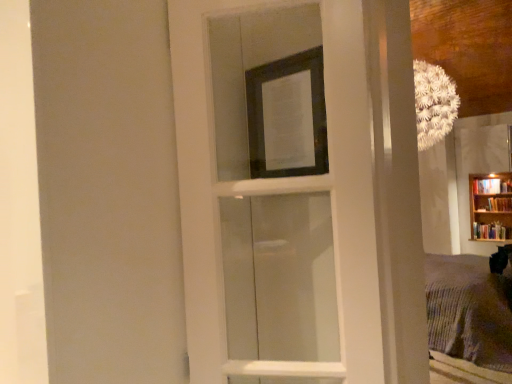
Question: Is wooden bookcase at right positioned beyond the bounds of white glass door at center?

Choices:
 (A) no
 (B) yes

Answer: (B)

Question: Is the depth of wooden bookcase at right greater than that of white glass door at center?

Choices:
 (A) no
 (B) yes

Answer: (B)

Question: Is there a large distance between wooden bookcase at right and white glass door at center?

Choices:
 (A) no
 (B) yes

Answer: (B)

Question: From the image's perspective, is wooden bookcase at right under white glass door at center?

Choices:
 (A) no
 (B) yes

Answer: (B)

Question: Is wooden bookcase at right bigger than white glass door at center?

Choices:
 (A) no
 (B) yes

Answer: (B)

Question: Does wooden bookcase at right appear on the right side of white glass door at center?

Choices:
 (A) yes
 (B) no

Answer: (A)

Question: From the image's perspective, is white glass door at center over wooden bookcase at right?

Choices:
 (A) no
 (B) yes

Answer: (B)

Question: Is white glass door at center oriented away from wooden bookcase at right?

Choices:
 (A) no
 (B) yes

Answer: (A)

Question: Would you say white glass door at center is outside wooden bookcase at right?

Choices:
 (A) yes
 (B) no

Answer: (A)

Question: From a real-world perspective, is white glass door at center on wooden bookcase at right?

Choices:
 (A) yes
 (B) no

Answer: (A)

Question: Does white glass door at center have a lesser height compared to wooden bookcase at right?

Choices:
 (A) no
 (B) yes

Answer: (A)

Question: Considering the relative positions of white glass door at center and wooden bookcase at right in the image provided, is white glass door at center to the right of wooden bookcase at right from the viewer's perspective?

Choices:
 (A) yes
 (B) no

Answer: (B)

Question: Considering the relative sizes of white glass door at center and transparent glass screen door at upper center in the image provided, is white glass door at center taller than transparent glass screen door at upper center?

Choices:
 (A) yes
 (B) no

Answer: (B)